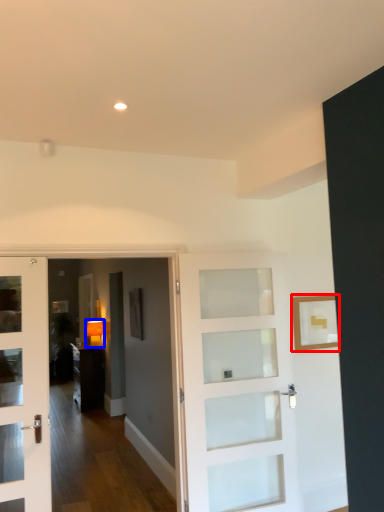
Question: Which object appears farthest to the camera in this image, picture frame (highlighted by a red box) or lamp (highlighted by a blue box)?

Choices:
 (A) picture frame
 (B) lamp

Answer: (B)